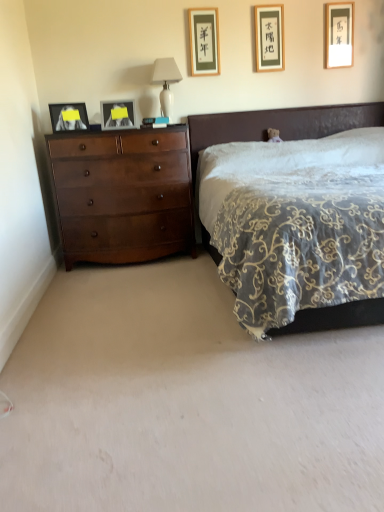
I want to click on vacant space underneath matte black picture frame at left, the 5th picture frame in the right-to-left sequence (from a real-world perspective), so click(x=72, y=131).